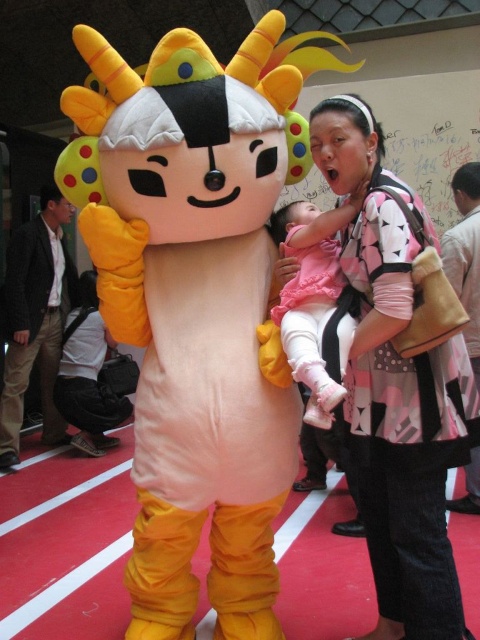
Question: Can you confirm if matte pink dress at center is positioned to the left of matte pink fabric baby at center?

Choices:
 (A) yes
 (B) no

Answer: (B)

Question: Is matte pink dress at center smaller than matte pink fabric baby at center?

Choices:
 (A) yes
 (B) no

Answer: (B)

Question: Which of the following is the farthest from the observer?

Choices:
 (A) matte pink fabric baby at center
 (B) matte pink dress at center

Answer: (B)

Question: Can you confirm if matte pink dress at center is positioned to the left of matte pink fabric baby at center?

Choices:
 (A) no
 (B) yes

Answer: (A)